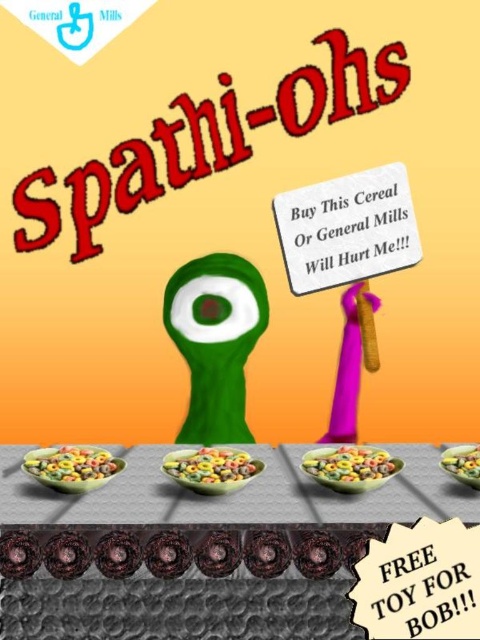
Based on the scene description, where is the multicolored cereal at center located in terms of coordinates?

The multicolored cereal at center is located at coordinates point (349, 465).

Consider the image. You are a delivery person who needs to place a new box of Spathi ohs cereal on the shelf. The shelf has a maximum height of 24 inches. Can you determine if the distance between the white paper sign at center and the multicolored cereal at center will allow the cereal box to fit on the shelf without exceeding the height limit?

The distance between the white paper sign at center and the multicolored cereal at center is 22.84 inches, which is under the 24 inch height limit. Therefore, the cereal box can be placed on the shelf without exceeding the height limit.

You are designing a cereal box for Spathi oh s. The box has a width of 6 inches. The multicolored cereal at center and smooth plastic bowl at center are 5.98 inches apart. Can the bowl fit inside the box if the cereal is placed at the center?

The multicolored cereal at center and smooth plastic bowl at center are 5.98 inches apart. Since the box is 6 inches wide, there is a 0.02 inch gap between the cereal and the edge of the box. Therefore, the bowl can fit inside the box with minimal space remaining.